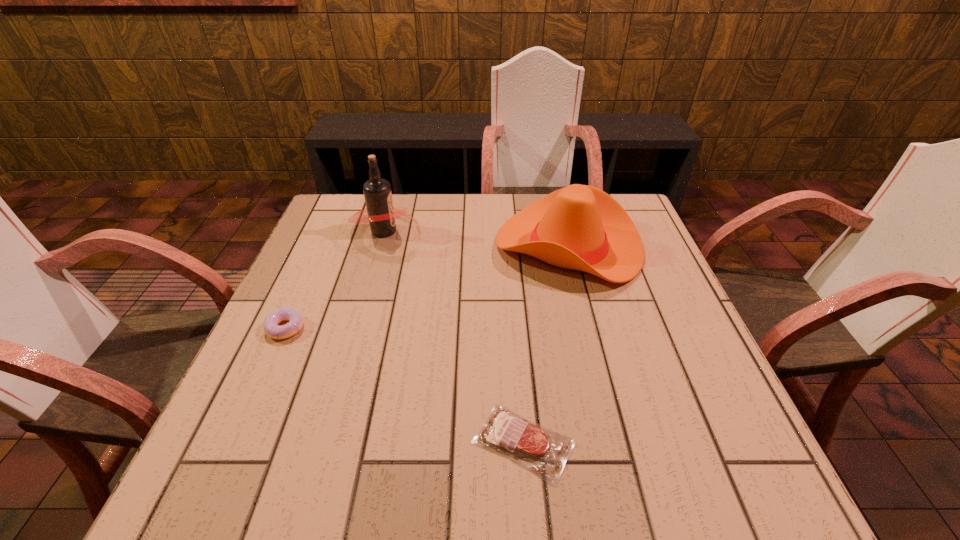
You are a GUI agent. You are given a task and a screenshot of the screen. Output one action in this format:
    pyautogui.click(x=<x>, y=<y>)
    Task: Click on the free space at the near edge of the desktop
    This screenshot has height=540, width=960.
    Given the screenshot: What is the action you would take?
    pyautogui.click(x=546, y=486)

Where is `vacant region at the left edge of the desktop`? This screenshot has height=540, width=960. vacant region at the left edge of the desktop is located at coordinates (269, 360).

At what (x,y) coordinates should I click in order to perform the action: click on vacant space at the right edge of the desktop. Please return your answer as a coordinate pair (x, y). Image resolution: width=960 pixels, height=540 pixels. Looking at the image, I should click on (709, 366).

Where is `blank area at the far left corner`? Image resolution: width=960 pixels, height=540 pixels. blank area at the far left corner is located at coordinates (333, 231).

Locate an element on the screen. free space at the near left corner of the desktop is located at coordinates (255, 476).

Locate an element on the screen. free space that is in between the root beer and the cowboy hat is located at coordinates (477, 238).

What are the coordinates of `vacant area between the nearest object and the third object from right to left` in the screenshot? It's located at (454, 336).

Locate an element on the screen. free point between the third farthest object and the root beer is located at coordinates (335, 279).

You are a GUI agent. You are given a task and a screenshot of the screen. Output one action in this format:
    pyautogui.click(x=<x>, y=<y>)
    Task: Click on the free space between the doughnut and the tallest object
    This screenshot has height=540, width=960.
    Given the screenshot: What is the action you would take?
    pyautogui.click(x=335, y=279)

The image size is (960, 540). What are the coordinates of `blank region between the cowboy hat and the root beer` in the screenshot? It's located at (477, 238).